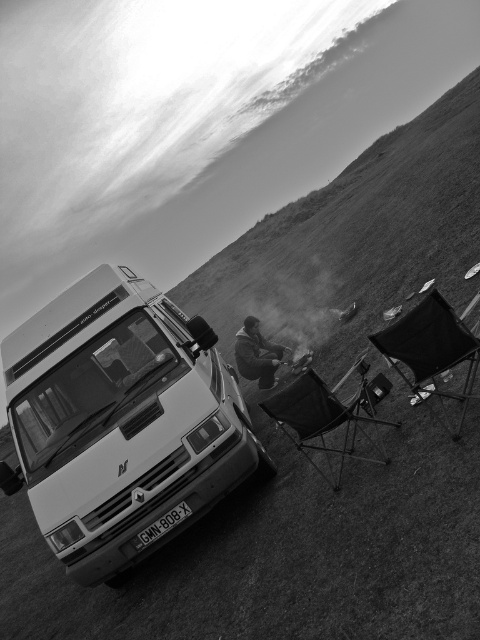
Can you confirm if dark fabric jacket at center is taller than black plastic license plate at center?

Indeed, dark fabric jacket at center has a greater height compared to black plastic license plate at center.

Consider the image. Between dark fabric jacket at center and black plastic license plate at center, which one is positioned higher?

dark fabric jacket at center is above.

Who is more distant from viewer, (x=257, y=321) or (x=163, y=534)?

Point (x=257, y=321)

Where is `dark fabric jacket at center`? dark fabric jacket at center is located at coordinates (256, 355).

Does point (173, 324) come behind point (276, 408)?

Yes, point (173, 324) is behind point (276, 408).

I want to click on white glossy van at center, so click(x=120, y=420).

Which is more to the left, white glossy van at center or black plastic license plate at center?

From the viewer's perspective, white glossy van at center appears more on the left side.

Can you confirm if white glossy van at center is taller than black plastic license plate at center?

Yes, white glossy van at center is taller than black plastic license plate at center.

Which is in front, point (171, 401) or point (162, 536)?

Positioned in front is point (162, 536).

The width and height of the screenshot is (480, 640). What are the coordinates of `white glossy van at center` in the screenshot? It's located at (120, 420).